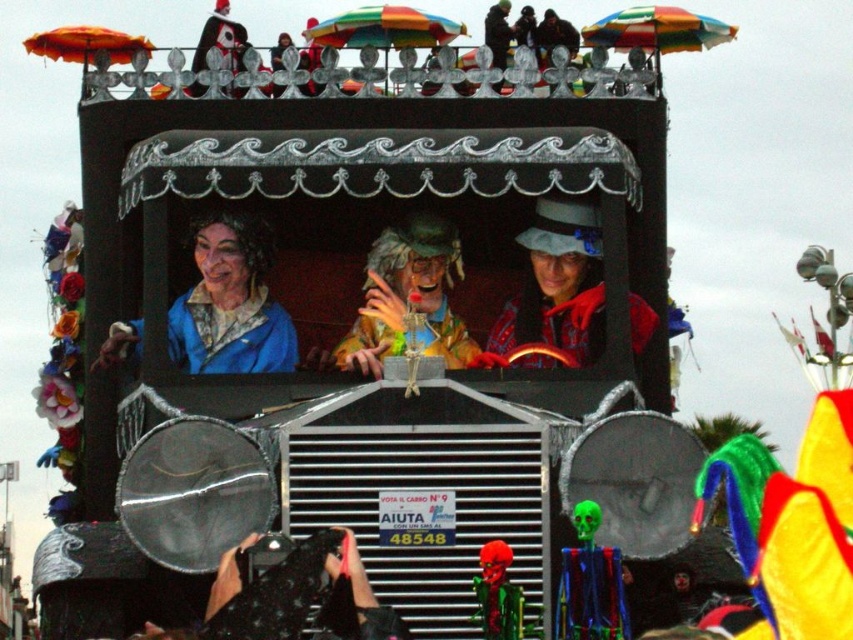
From the picture: Does matte yellow costume at center have a lesser width compared to dark brown leather jacket at upper center?

No.

The height and width of the screenshot is (640, 853). What do you see at coordinates (408, 296) in the screenshot?
I see `matte yellow costume at center` at bounding box center [408, 296].

The height and width of the screenshot is (640, 853). In order to click on matte yellow costume at center in this screenshot , I will do `click(408, 296)`.

Does matte blue coat at center appear on the left side of matte yellow costume at center?

Indeed, matte blue coat at center is positioned on the left side of matte yellow costume at center.

Does point (234, 257) lie in front of point (437, 339)?

Yes, it is in front of point (437, 339).

Locate an element on the screen. matte blue coat at center is located at coordinates (230, 305).

Is point (281, 362) positioned after point (538, 276)?

No, (281, 362) is in front of (538, 276).

Can you confirm if matte blue coat at center is smaller than red fabric hat at center?

Yes.

Does point (224, 349) come behind point (492, 349)?

No, (224, 349) is closer to viewer.

Locate an element on the screen. matte blue coat at center is located at coordinates (230, 305).